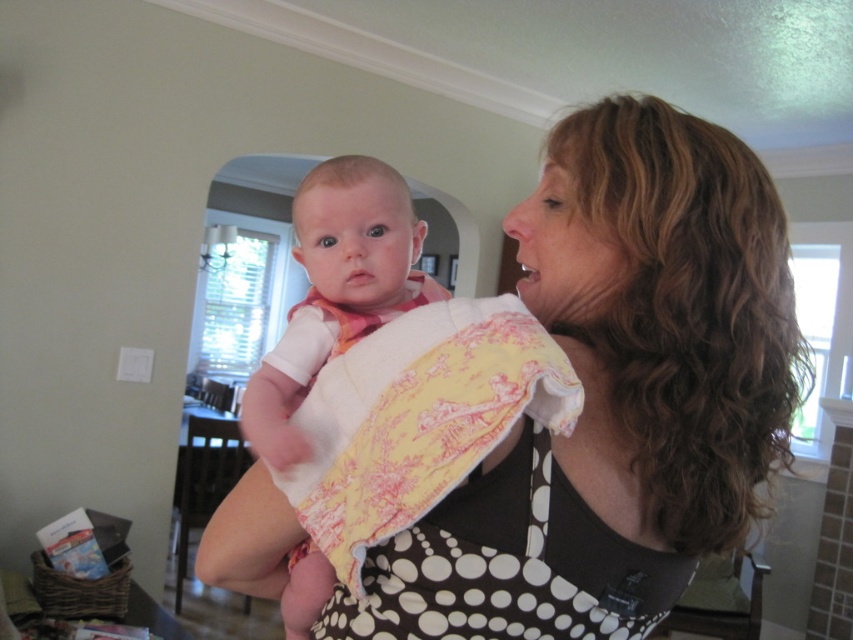
Does polka dot fabric at center appear under yellow printed fabric at center?

Incorrect, polka dot fabric at center is not positioned below yellow printed fabric at center.

Who is more distant from viewer, [548,634] or [451,547]?

The point [548,634] is behind.

At what (x,y) coordinates should I click in order to perform the action: click on polka dot fabric at center. Please return your answer as a coordinate pair (x, y). Looking at the image, I should click on (618, 392).

Between polka dot fabric at center and soft yellow fabric baby at center, which one is positioned higher?

Positioned higher is soft yellow fabric baby at center.

Is polka dot fabric at center to the right of soft yellow fabric baby at center from the viewer's perspective?

Indeed, polka dot fabric at center is positioned on the right side of soft yellow fabric baby at center.

Image resolution: width=853 pixels, height=640 pixels. What do you see at coordinates (618, 392) in the screenshot?
I see `polka dot fabric at center` at bounding box center [618, 392].

Identify the location of polka dot fabric at center. The image size is (853, 640). (618, 392).

Does yellow printed fabric at center appear over soft yellow fabric baby at center?

No.

Who is more distant from viewer, (460, 572) or (387, 280)?

The point (387, 280) is more distant.

You are a GUI agent. You are given a task and a screenshot of the screen. Output one action in this format:
    pyautogui.click(x=<x>, y=<y>)
    Task: Click on the yellow printed fabric at center
    The image size is (853, 640).
    Given the screenshot: What is the action you would take?
    pyautogui.click(x=509, y=564)